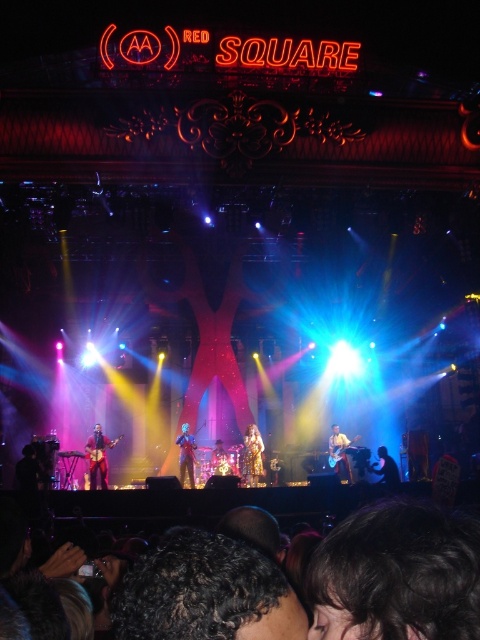
Question: Which of these objects is positioned farthest from the matte black guitar at lower left?

Choices:
 (A) matte black guitar at center
 (B) shiny silver guitar at center

Answer: (A)

Question: Which object appears farthest from the camera in this image?

Choices:
 (A) matte black guitar at lower left
 (B) sparkly gold dress at center

Answer: (A)

Question: Where is matte black guitar at lower left located in relation to sparkly gold dress at center in the image?

Choices:
 (A) below
 (B) above

Answer: (A)

Question: Does sparkly gold dress at center appear on the right side of shiny blue suit at center?

Choices:
 (A) no
 (B) yes

Answer: (B)

Question: Which point is closer to the camera?

Choices:
 (A) (250, 470)
 (B) (395, 465)
 (C) (192, 472)
 (D) (93, 483)

Answer: (C)

Question: Can you confirm if shiny silver guitar at center is positioned below shiny blue suit at center?

Choices:
 (A) no
 (B) yes

Answer: (B)